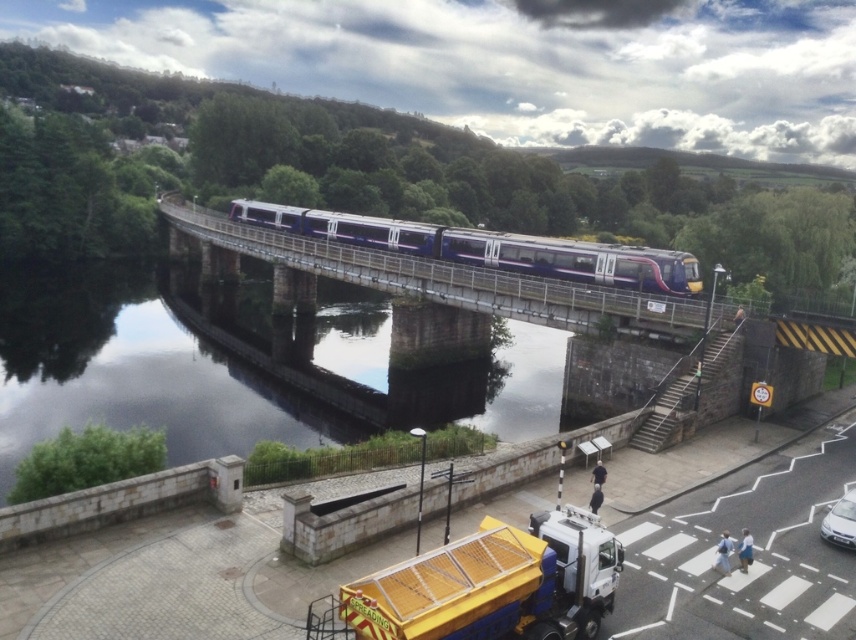
Can you confirm if dark reflective water at center is positioned to the left of yellow mesh truck at lower center?

Indeed, dark reflective water at center is positioned on the left side of yellow mesh truck at lower center.

Can you confirm if dark reflective water at center is taller than yellow mesh truck at lower center?

Correct, dark reflective water at center is much taller as yellow mesh truck at lower center.

Is point (126, 417) less distant than point (503, 589)?

No, it is behind (503, 589).

This screenshot has height=640, width=856. I want to click on dark reflective water at center, so click(x=134, y=371).

Which of these two, purple glossy train at center or silver metallic car at lower right, stands shorter?

silver metallic car at lower right

Does purple glossy train at center have a greater height compared to silver metallic car at lower right?

Correct, purple glossy train at center is much taller as silver metallic car at lower right.

Between point (532, 240) and point (849, 529), which one is positioned behind?

The point (532, 240) is behind.

Identify the location of purple glossy train at center. This screenshot has width=856, height=640. (489, 248).

Which is more to the right, dark reflective water at center or silver metallic car at lower right?

Positioned to the right is silver metallic car at lower right.

Image resolution: width=856 pixels, height=640 pixels. In order to click on dark reflective water at center in this screenshot , I will do `click(134, 371)`.

You are a GUI agent. You are given a task and a screenshot of the screen. Output one action in this format:
    pyautogui.click(x=<x>, y=<y>)
    Task: Click on the dark reflective water at center
    The width and height of the screenshot is (856, 640).
    Given the screenshot: What is the action you would take?
    pyautogui.click(x=134, y=371)